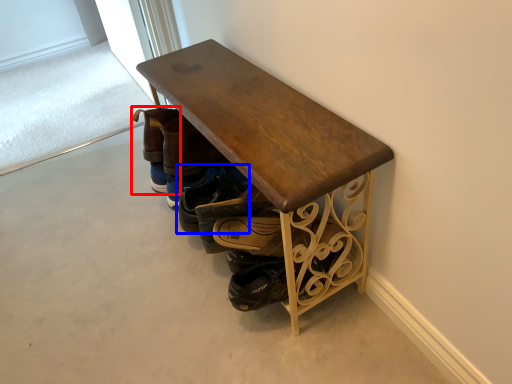
Question: Which object is closer to the camera taking this photo, footwear (highlighted by a red box) or footwear (highlighted by a blue box)?

Choices:
 (A) footwear
 (B) footwear

Answer: (B)